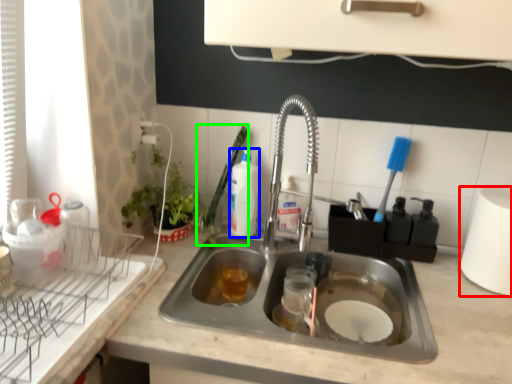
Question: Which is nearer to the paper towel (highlighted by a red box)? beverage (highlighted by a blue box) or brush (highlighted by a green box).

Choices:
 (A) beverage
 (B) brush

Answer: (A)